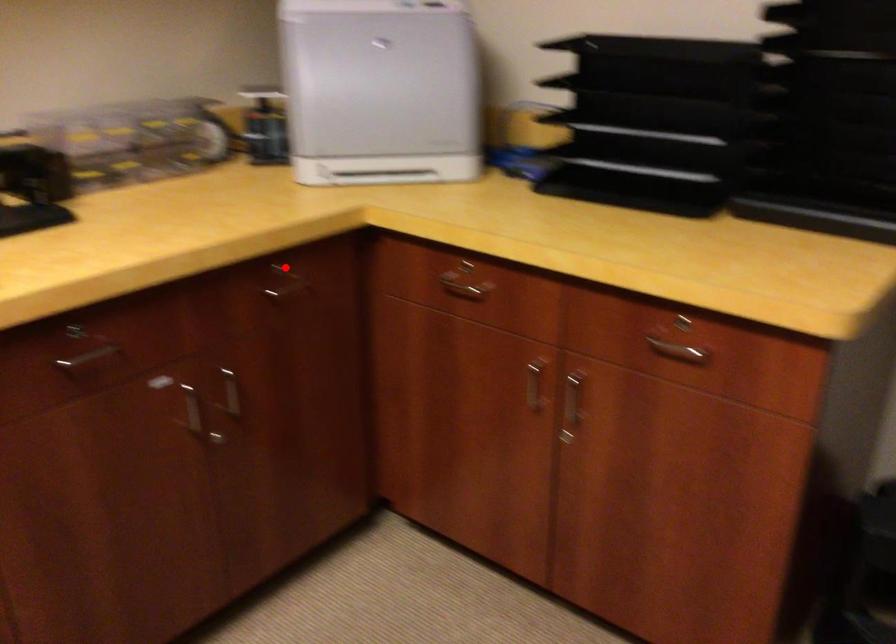
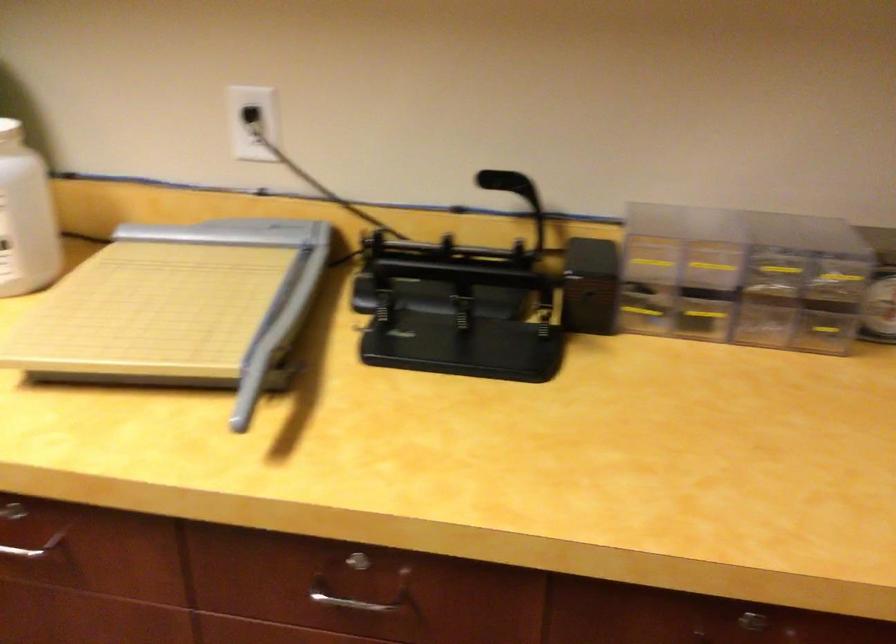
In the second image, find the point that corresponds to the highlighted location in the first image.

(748, 623)